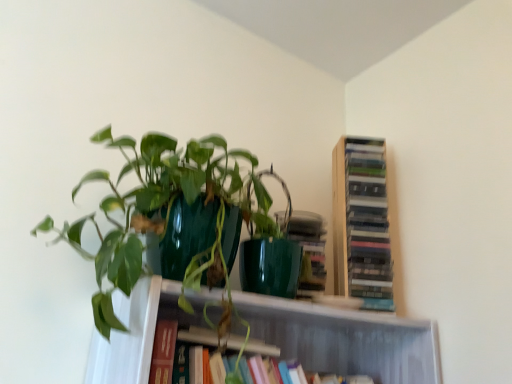
What do you see at coordinates (176, 348) in the screenshot? I see `hardcover book at center, which is the second book in top-to-bottom order` at bounding box center [176, 348].

Where is `wooden bookshelf at upper right, the first book positioned from the top`? wooden bookshelf at upper right, the first book positioned from the top is located at coordinates 362,223.

Is wooden bookshelf at upper right, the 2th book positioned from the bottom, facing away from green glossy pot at upper left?

wooden bookshelf at upper right, the 2th book positioned from the bottom, does not have its back to green glossy pot at upper left.

From the image's perspective, which is above, wooden bookshelf at upper right, the first book positioned from the top, or green glossy pot at upper left?

wooden bookshelf at upper right, the first book positioned from the top, from the image's perspective.

Where is `book that is the 2nd object located behind the green glossy pot at upper left`? This screenshot has height=384, width=512. book that is the 2nd object located behind the green glossy pot at upper left is located at coordinates (362, 223).

Would you consider wooden bookshelf at upper right, the 2th book positioned from the bottom, to be distant from green glossy pot at upper left?

No, there isn't a large distance between wooden bookshelf at upper right, the 2th book positioned from the bottom, and green glossy pot at upper left.

Which object is wider, hardcover book at center, the 1th book ordered from the bottom, or wooden bookshelf at upper right, the first book positioned from the top?

With larger width is hardcover book at center, the 1th book ordered from the bottom.

Which is behind, point (184, 348) or point (366, 227)?

The point (366, 227) is more distant.

Can you confirm if hardcover book at center, which is the second book in top-to-bottom order, is bigger than wooden bookshelf at upper right, the first book positioned from the top?

Correct, hardcover book at center, which is the second book in top-to-bottom order, is larger in size than wooden bookshelf at upper right, the first book positioned from the top.

How different are the orientations of hardcover book at center, the 1th book ordered from the bottom, and wooden bookshelf at upper right, the first book positioned from the top, in degrees?

28.1 degrees separate the facing orientations of hardcover book at center, the 1th book ordered from the bottom, and wooden bookshelf at upper right, the first book positioned from the top.

From the image's perspective, is green glossy pot at upper left positioned above or below hardcover book at center, which is the second book in top-to-bottom order?

Based on their image positions, green glossy pot at upper left is located above hardcover book at center, which is the second book in top-to-bottom order.

How many degrees apart are the facing directions of green glossy pot at upper left and hardcover book at center, the 1th book ordered from the bottom?

green glossy pot at upper left and hardcover book at center, the 1th book ordered from the bottom, are facing 0.000756 degrees away from each other.

Is green glossy pot at upper left oriented away from hardcover book at center, which is the second book in top-to-bottom order?

No, green glossy pot at upper left's orientation is not away from hardcover book at center, which is the second book in top-to-bottom order.

Does green glossy pot at upper left appear on the left side of hardcover book at center, which is the second book in top-to-bottom order?

Correct, you'll find green glossy pot at upper left to the left of hardcover book at center, which is the second book in top-to-bottom order.

Is green glossy pot at upper left located within hardcover book at center, which is the second book in top-to-bottom order?

Actually, green glossy pot at upper left is outside hardcover book at center, which is the second book in top-to-bottom order.

Considering the relative sizes of hardcover book at center, which is the second book in top-to-bottom order, and green glossy pot at upper left in the image provided, is hardcover book at center, which is the second book in top-to-bottom order, bigger than green glossy pot at upper left?

No, hardcover book at center, which is the second book in top-to-bottom order, is not bigger than green glossy pot at upper left.

Consider the image. Is the depth of hardcover book at center, which is the second book in top-to-bottom order, less than that of green glossy pot at upper left?

No, the depth of hardcover book at center, which is the second book in top-to-bottom order, is greater than that of green glossy pot at upper left.

In the scene shown: Can you confirm if green glossy pot at upper left is wider than wooden bookshelf at upper right, the 2th book positioned from the bottom?

Indeed, green glossy pot at upper left has a greater width compared to wooden bookshelf at upper right, the 2th book positioned from the bottom.

Are green glossy pot at upper left and wooden bookshelf at upper right, the 2th book positioned from the bottom, beside each other?

No, green glossy pot at upper left is not beside wooden bookshelf at upper right, the 2th book positioned from the bottom.

Does green glossy pot at upper left appear on the left side of wooden bookshelf at upper right, the 2th book positioned from the bottom?

Indeed, green glossy pot at upper left is positioned on the left side of wooden bookshelf at upper right, the 2th book positioned from the bottom.

Considering the relative sizes of green glossy pot at upper left and wooden bookshelf at upper right, the first book positioned from the top, in the image provided, is green glossy pot at upper left taller than wooden bookshelf at upper right, the first book positioned from the top,?

No, green glossy pot at upper left is not taller than wooden bookshelf at upper right, the first book positioned from the top.

Are wooden bookshelf at upper right, the first book positioned from the top, and hardcover book at center, the 1th book ordered from the bottom, far apart?

No, wooden bookshelf at upper right, the first book positioned from the top, is not far from hardcover book at center, the 1th book ordered from the bottom.

From the image's perspective, which one is positioned lower, wooden bookshelf at upper right, the first book positioned from the top, or hardcover book at center, which is the second book in top-to-bottom order?

hardcover book at center, which is the second book in top-to-bottom order, from the image's perspective.

How many degrees apart are the facing directions of wooden bookshelf at upper right, the first book positioned from the top, and hardcover book at center, the 1th book ordered from the bottom?

wooden bookshelf at upper right, the first book positioned from the top, and hardcover book at center, the 1th book ordered from the bottom, are facing 28.1 degrees away from each other.

Where is `book located above the green glossy pot at upper left (from a real-world perspective)`? book located above the green glossy pot at upper left (from a real-world perspective) is located at coordinates (362, 223).

At what (x,y) coordinates should I click in order to perform the action: click on book that is below the wooden bookshelf at upper right, the first book positioned from the top (from the image's perspective). Please return your answer as a coordinate pair (x, y). The width and height of the screenshot is (512, 384). Looking at the image, I should click on (176, 348).

Considering their positions, is green glossy pot at upper left positioned further to wooden bookshelf at upper right, the 2th book positioned from the bottom, than hardcover book at center, the 1th book ordered from the bottom?

Among the two, green glossy pot at upper left is located further to wooden bookshelf at upper right, the 2th book positioned from the bottom.

Looking at the image, which one is located further to green glossy pot at upper left, wooden bookshelf at upper right, the first book positioned from the top, or hardcover book at center, which is the second book in top-to-bottom order?

The object further to green glossy pot at upper left is wooden bookshelf at upper right, the first book positioned from the top.

Looking at the image, which one is located further to green glossy pot at upper left, hardcover book at center, which is the second book in top-to-bottom order, or wooden bookshelf at upper right, the 2th book positioned from the bottom?

Based on the image, wooden bookshelf at upper right, the 2th book positioned from the bottom, appears to be further to green glossy pot at upper left.

Estimate the real-world distances between objects in this image. Which object is further from hardcover book at center, the 1th book ordered from the bottom, green glossy pot at upper left or wooden bookshelf at upper right, the 2th book positioned from the bottom?

wooden bookshelf at upper right, the 2th book positioned from the bottom.

From the image, which object appears to be farther from wooden bookshelf at upper right, the 2th book positioned from the bottom, hardcover book at center, the 1th book ordered from the bottom, or green glossy pot at upper left?

green glossy pot at upper left is positioned further to the anchor wooden bookshelf at upper right, the 2th book positioned from the bottom.

From the image, which object appears to be nearer to hardcover book at center, which is the second book in top-to-bottom order, wooden bookshelf at upper right, the 2th book positioned from the bottom, or green glossy pot at upper left?

green glossy pot at upper left is closer to hardcover book at center, which is the second book in top-to-bottom order.

Locate an element on the screen. book positioned between green glossy pot at upper left and wooden bookshelf at upper right, the 2th book positioned from the bottom, from near to far is located at coordinates (176, 348).